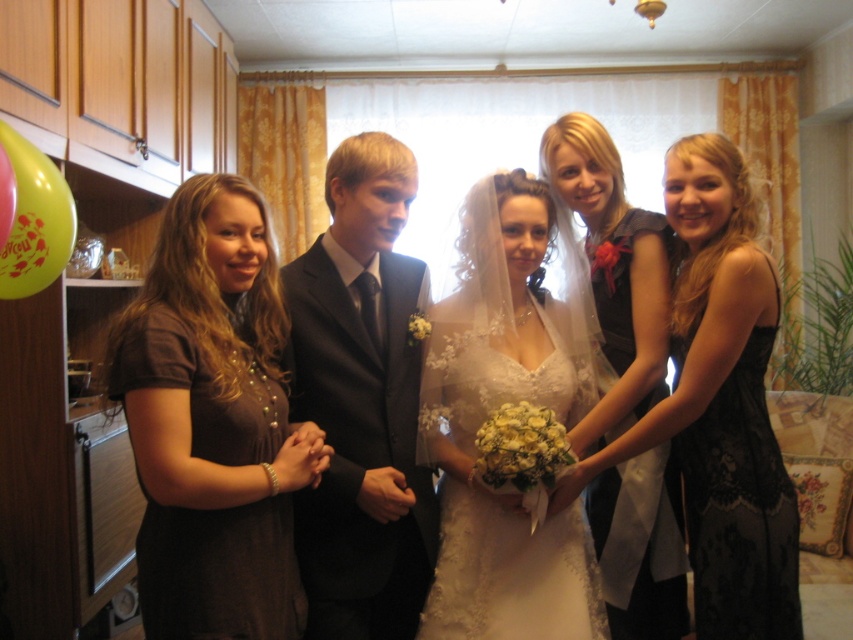
You are standing at the point labeled point [473,358] and want to move to the point labeled point [558,177]. Can you walk directly towards it without any obstacles in between?

Yes, since point [473,358] is in front of point [558,177], there are no obstacles between them, so you can walk directly towards it.

You are a photographer at this event and need to position a light to the right of both the brown matte dress at left and the shiny black suit at center. Is this possible based on their positions?

The brown matte dress at left is to the left of the shiny black suit at center. Since the shiny black suit at center is already to the right of the brown matte dress at left, placing the light to the right of both would require positioning it further to the right of the shiny black suit at center, which is possible if there is enough space.

Looking at this image, you are a photographer positioned to the side of the group. You need to adjust your camera focus to ensure both the brown matte dress at left and the matte white dress at center are in clear view. Which dress should you focus on first to account for their positions?

You should focus on the brown matte dress at left first because it is closer to the viewer than the matte white dress at center, so adjusting focus starting from the closer object ensures both are in clear view.